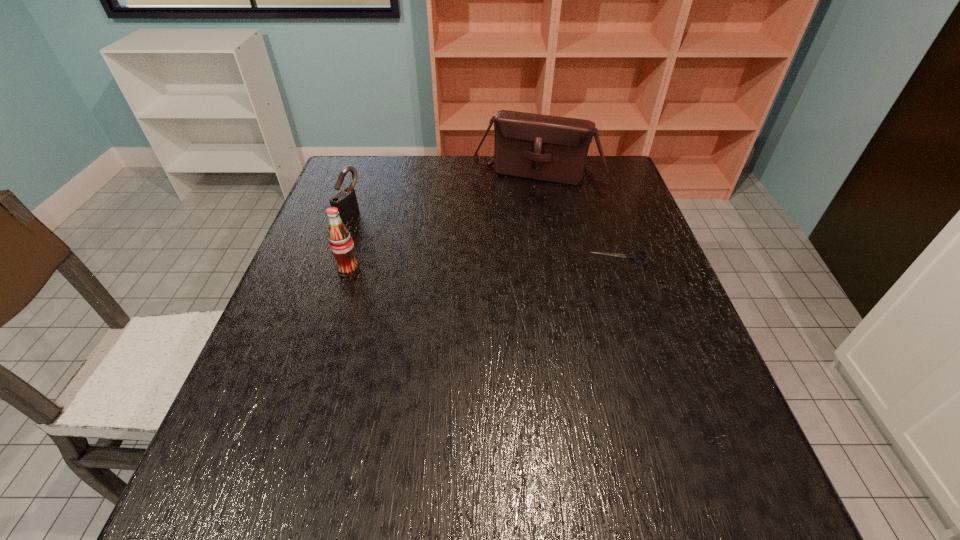
The height and width of the screenshot is (540, 960). Find the location of `free space at the near edge of the desktop`. free space at the near edge of the desktop is located at coordinates (507, 441).

Where is `vacant space at the left edge of the desktop`? vacant space at the left edge of the desktop is located at coordinates (322, 252).

You are a GUI agent. You are given a task and a screenshot of the screen. Output one action in this format:
    pyautogui.click(x=<x>, y=<y>)
    Task: Click on the free space at the right edge of the desktop
    Image resolution: width=960 pixels, height=540 pixels.
    Given the screenshot: What is the action you would take?
    pyautogui.click(x=608, y=286)

Identify the location of vacant space at the far left corner of the desktop. (334, 184).

I want to click on unoccupied position between the shortest object and the soda, so click(484, 265).

Identify the location of vacant space in between the shortest object and the third tallest object. click(x=485, y=236).

Where is `free spot between the second farthest object and the shoulder bag`? free spot between the second farthest object and the shoulder bag is located at coordinates (444, 194).

Find the location of a particular element. The image size is (960, 540). free space between the shoulder bag and the second shortest object is located at coordinates (444, 194).

I want to click on free spot between the shortest object and the soda, so click(x=484, y=265).

At what (x,y) coordinates should I click in order to perform the action: click on free space between the third nearest object and the shoulder bag. Please return your answer as a coordinate pair (x, y). Image resolution: width=960 pixels, height=540 pixels. Looking at the image, I should click on (444, 194).